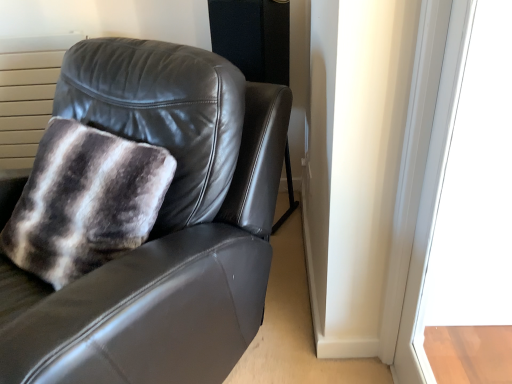
Where is `matte black leather chair at upper left`? The height and width of the screenshot is (384, 512). matte black leather chair at upper left is located at coordinates point(166,223).

What do you see at coordinates (166, 223) in the screenshot?
I see `matte black leather chair at upper left` at bounding box center [166, 223].

What do you see at coordinates (432, 204) in the screenshot? I see `transparent glass door at upper right` at bounding box center [432, 204].

Identify the location of transparent glass door at upper right. (432, 204).

This screenshot has width=512, height=384. What are the coordinates of `matte black leather chair at upper left` in the screenshot? It's located at (166, 223).

Considering the relative positions of transparent glass door at upper right and matte black leather chair at upper left in the image provided, is transparent glass door at upper right to the right of matte black leather chair at upper left from the viewer's perspective?

Indeed, transparent glass door at upper right is positioned on the right side of matte black leather chair at upper left.

Is the position of transparent glass door at upper right less distant than that of matte black leather chair at upper left?

That is True.

Which point is more forward, (453, 34) or (198, 97)?

The point (453, 34) is closer to the camera.

From the image's perspective, between transparent glass door at upper right and matte black leather chair at upper left, who is located below?

transparent glass door at upper right is shown below in the image.

From a real-world perspective, is transparent glass door at upper right positioned above or below matte black leather chair at upper left?

In terms of real-world spatial position, transparent glass door at upper right is above matte black leather chair at upper left.

In the scene shown: Is transparent glass door at upper right thinner than matte black leather chair at upper left?

Correct, the width of transparent glass door at upper right is less than that of matte black leather chair at upper left.

From their relative heights in the image, would you say transparent glass door at upper right is taller or shorter than matte black leather chair at upper left?

In the image, transparent glass door at upper right appears to be taller than matte black leather chair at upper left.

Who is bigger, transparent glass door at upper right or matte black leather chair at upper left?

matte black leather chair at upper left.

Is transparent glass door at upper right completely or partially outside of matte black leather chair at upper left?

Indeed, transparent glass door at upper right is completely outside matte black leather chair at upper left.

Would you consider transparent glass door at upper right to be distant from matte black leather chair at upper left?

No.

Is transparent glass door at upper right oriented towards matte black leather chair at upper left?

Yes, transparent glass door at upper right is aimed at matte black leather chair at upper left.

Where is `chair lying above the transparent glass door at upper right (from the image's perspective)`? chair lying above the transparent glass door at upper right (from the image's perspective) is located at coordinates (166, 223).

Considering the positions of objects matte black leather chair at upper left and transparent glass door at upper right in the image provided, who is more to the left, matte black leather chair at upper left or transparent glass door at upper right?

From the viewer's perspective, matte black leather chair at upper left appears more on the left side.

Based on the photo, between matte black leather chair at upper left and transparent glass door at upper right, which one is positioned behind?

matte black leather chair at upper left is more distant.

Which is closer to the camera, (57, 105) or (414, 239)?

The point (414, 239) is in front.

From the image's perspective, is matte black leather chair at upper left beneath transparent glass door at upper right?

No.

Looking at this image, from a real-world perspective, which object rests below the other?

matte black leather chair at upper left, from a real-world perspective.

Considering the relative sizes of matte black leather chair at upper left and transparent glass door at upper right in the image provided, is matte black leather chair at upper left thinner than transparent glass door at upper right?

No, matte black leather chair at upper left is not thinner than transparent glass door at upper right.

Considering the relative sizes of matte black leather chair at upper left and transparent glass door at upper right in the image provided, is matte black leather chair at upper left shorter than transparent glass door at upper right?

Indeed, matte black leather chair at upper left has a lesser height compared to transparent glass door at upper right.

Is matte black leather chair at upper left bigger than transparent glass door at upper right?

Indeed, matte black leather chair at upper left has a larger size compared to transparent glass door at upper right.

Is matte black leather chair at upper left not inside transparent glass door at upper right?

Yes, matte black leather chair at upper left is not within transparent glass door at upper right.

Consider the image. Are matte black leather chair at upper left and transparent glass door at upper right beside each other?

No, matte black leather chair at upper left is not in contact with transparent glass door at upper right.

Could you tell me if matte black leather chair at upper left is facing transparent glass door at upper right?

No, matte black leather chair at upper left is not oriented towards transparent glass door at upper right.

You are a GUI agent. You are given a task and a screenshot of the screen. Output one action in this format:
    pyautogui.click(x=<x>, y=<y>)
    Task: Click on the chair that appears behind the transparent glass door at upper right
    
    Given the screenshot: What is the action you would take?
    pyautogui.click(x=166, y=223)

In order to click on window that appears below the matte black leather chair at upper left (from the image's perspective) in this screenshot , I will do `click(432, 204)`.

Find the location of a particular element. This screenshot has height=384, width=512. window on the right of the matte black leather chair at upper left is located at coordinates (432, 204).